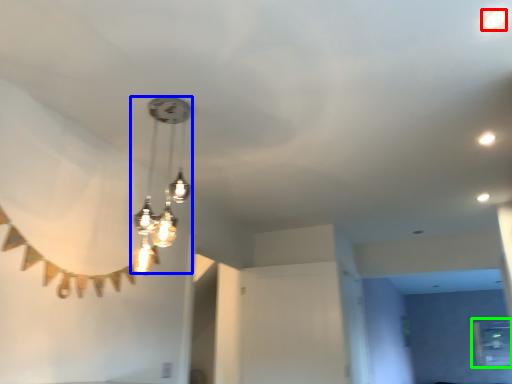
Question: Which object is positioned closest to droplight (highlighted by a red box)? Select from lamp (highlighted by a blue box) and window (highlighted by a green box).

Choices:
 (A) lamp
 (B) window

Answer: (A)